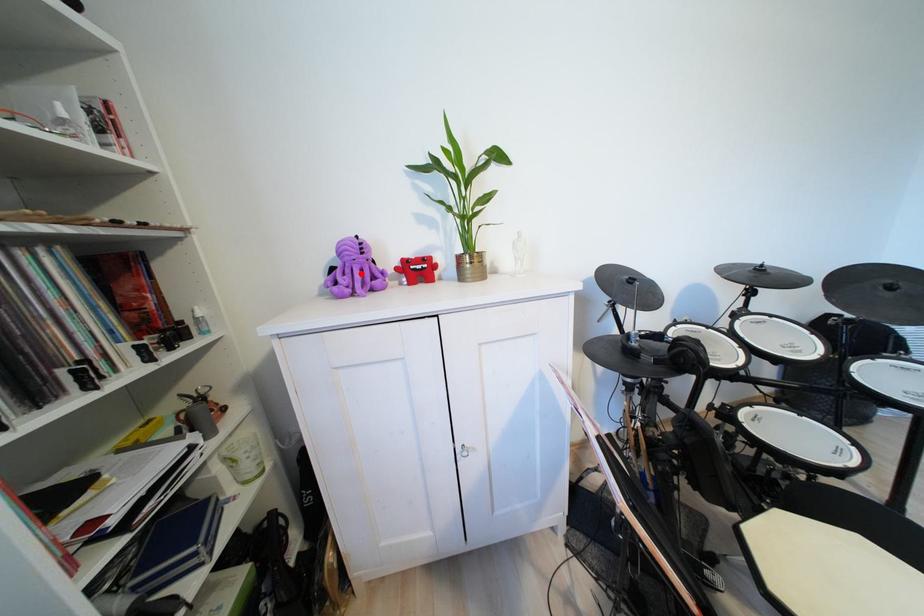
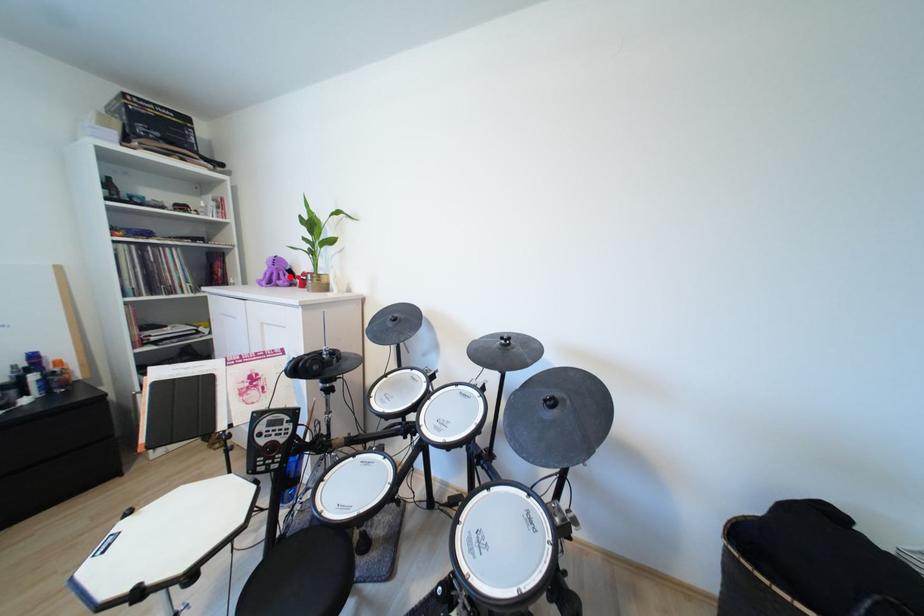
I am providing you with two images of the same scene from different viewpoints. A red point is marked on the first image and another point is marked on the second image. Is the red point in image1 aligned with the point shown in image2?

Yes